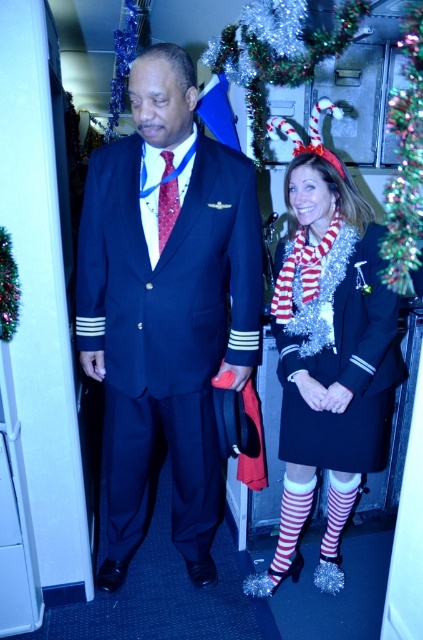
Which of these two, red and white striped stockings at right or shiny silver dress at center, stands taller?

red and white striped stockings at right

Is point (293, 516) behind point (370, 292)?

Yes, it is behind point (370, 292).

Locate an element on the screen. The width and height of the screenshot is (423, 640). red and white striped stockings at right is located at coordinates (329, 358).

Can you confirm if shiny dark blue suit at center is shorter than red and white striped stockings at right?

No.

Between shiny dark blue suit at center and red and white striped stockings at right, which one is positioned lower?

red and white striped stockings at right is lower down.

Describe the element at coordinates (165, 305) in the screenshot. I see `shiny dark blue suit at center` at that location.

I want to click on shiny dark blue suit at center, so click(x=165, y=305).

Is shiny dark blue suit at center positioned in front of shiny silver dress at center?

Yes, it is.

Who is more distant from viewer, (172, 120) or (381, 314)?

Point (381, 314)

Image resolution: width=423 pixels, height=640 pixels. In order to click on shiny dark blue suit at center in this screenshot , I will do `click(165, 305)`.